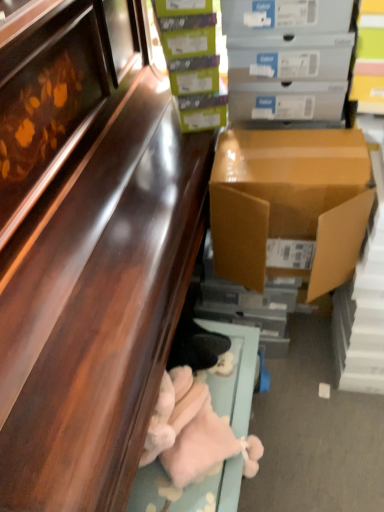
Question: Is shiny brown cabinet at lower left wider or thinner than matte gray cardboard box at upper right, placed as the first box when sorted from top to bottom?

Choices:
 (A) thin
 (B) wide

Answer: (B)

Question: Which is correct: shiny brown cabinet at lower left is inside matte gray cardboard box at upper right, placed as the first box when sorted from top to bottom, or outside of it?

Choices:
 (A) inside
 (B) outside

Answer: (B)

Question: Which object is positioned farthest from the brown cardboard box at right, the first box when ordered from bottom to top?

Choices:
 (A) fluffy pink stuffed animal at lower center
 (B) shiny brown cabinet at lower left
 (C) matte gray cardboard box at upper right, placed as the first box when sorted from top to bottom
 (D) green matte box at upper center, placed as the second box when sorted from bottom to top

Answer: (A)

Question: Based on their relative distances, which object is nearer to the green matte box at upper center, arranged as the 2th box when viewed from the top?

Choices:
 (A) fluffy pink stuffed animal at lower center
 (B) shiny brown cabinet at lower left
 (C) brown cardboard box at right, the first box when ordered from bottom to top
 (D) matte gray cardboard box at upper right, which is the 3th box in bottom-to-top order

Answer: (D)